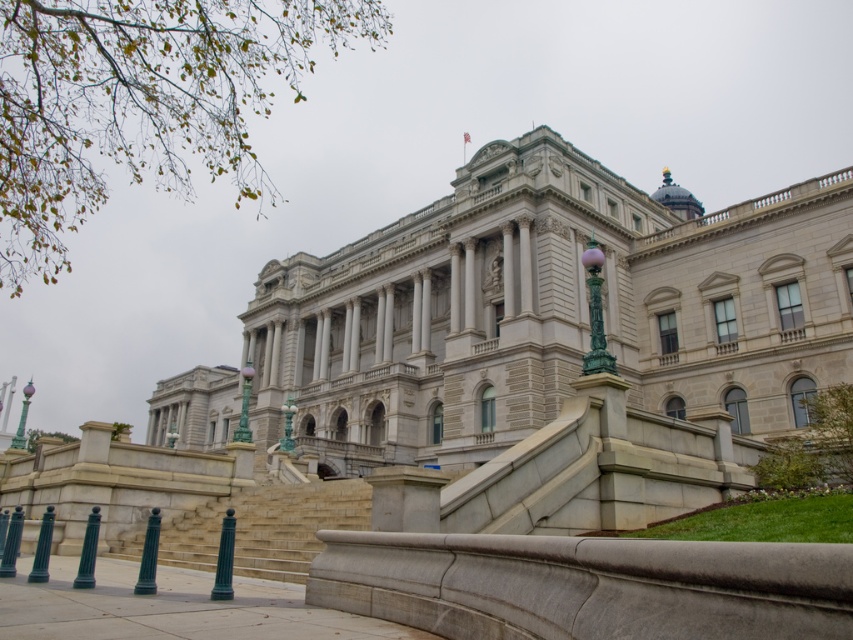
Question: Which point is closer to the camera taking this photo?

Choices:
 (A) [251, 362]
 (B) [85, 534]
 (C) [25, 396]

Answer: (B)

Question: Does green patinated metal lamp post at center-right appear on the right side of matte green pole at lower left?

Choices:
 (A) no
 (B) yes

Answer: (B)

Question: Estimate the real-world distances between objects in this image. Which object is farther from the green patinated metal lamp post at center-right?

Choices:
 (A) green metallic pole at lower left
 (B) matte green pole at lower left
 (C) green polished metal lamp post at lower center
 (D) green matte pole at lower left

Answer: (C)

Question: Which of the following is the closest to the observer?

Choices:
 (A) (595, 332)
 (B) (224, 586)
 (C) (241, 509)

Answer: (B)

Question: Is green patinated metal lamp post at center-right smaller than green polished metal lamp post at lower center?

Choices:
 (A) no
 (B) yes

Answer: (B)

Question: Does matte green pole at lower left appear on the right side of green polished metal lamp post at lower left?

Choices:
 (A) yes
 (B) no

Answer: (A)